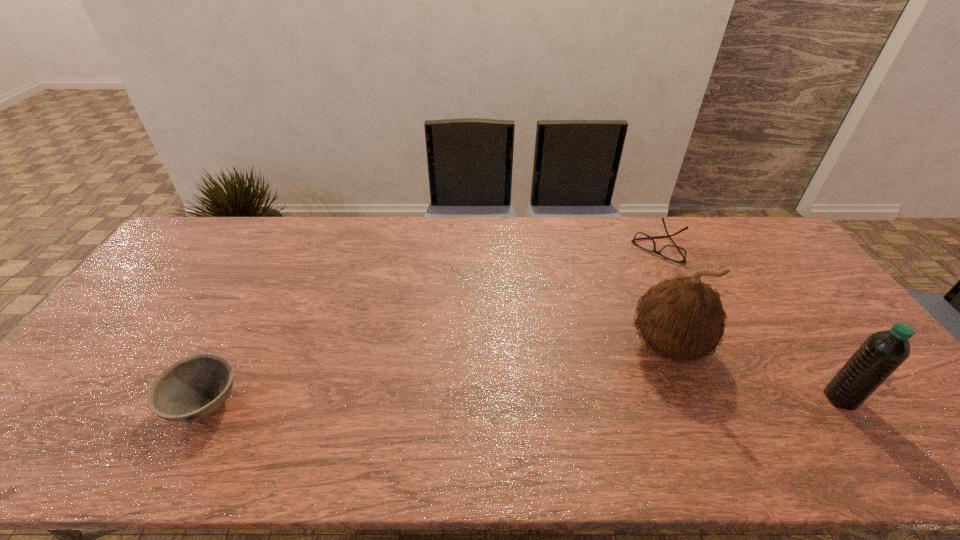
The width and height of the screenshot is (960, 540). I want to click on vacant space that satisfies the following two spatial constraints: 1. on the back side of the second shortest object; 2. on the right side of the shortest object, so click(x=288, y=246).